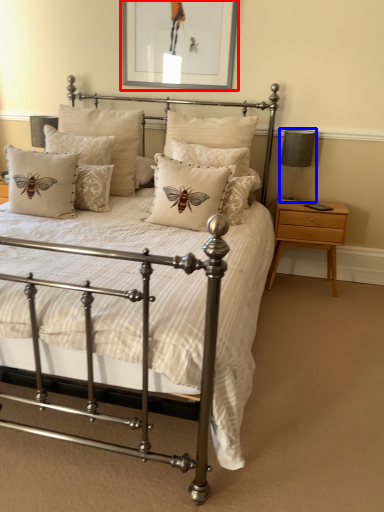
Question: Which point is further to the camera, picture frame (highlighted by a red box) or table lamp (highlighted by a blue box)?

Choices:
 (A) picture frame
 (B) table lamp

Answer: (B)